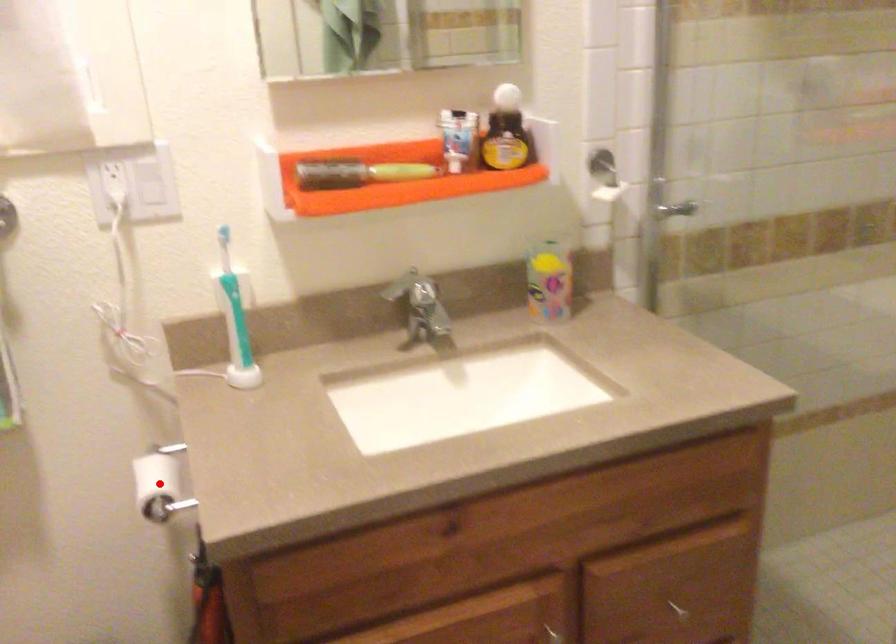
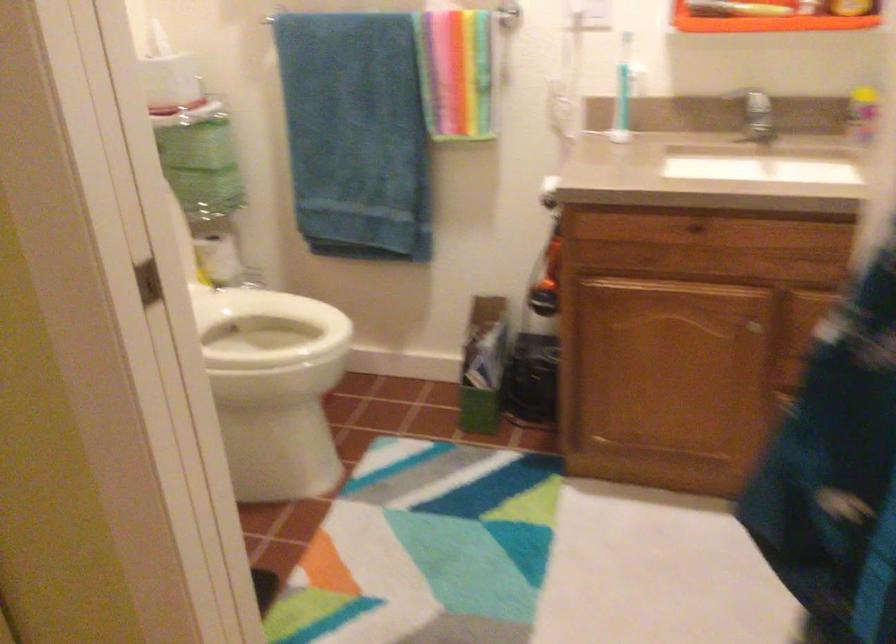
Question: I am providing you with two images of the same scene from different viewpoints. A red point is marked on the first image. At the location where the point appears in image 1, is it still visible in image 2?

Choices:
 (A) Yes
 (B) No

Answer: (B)